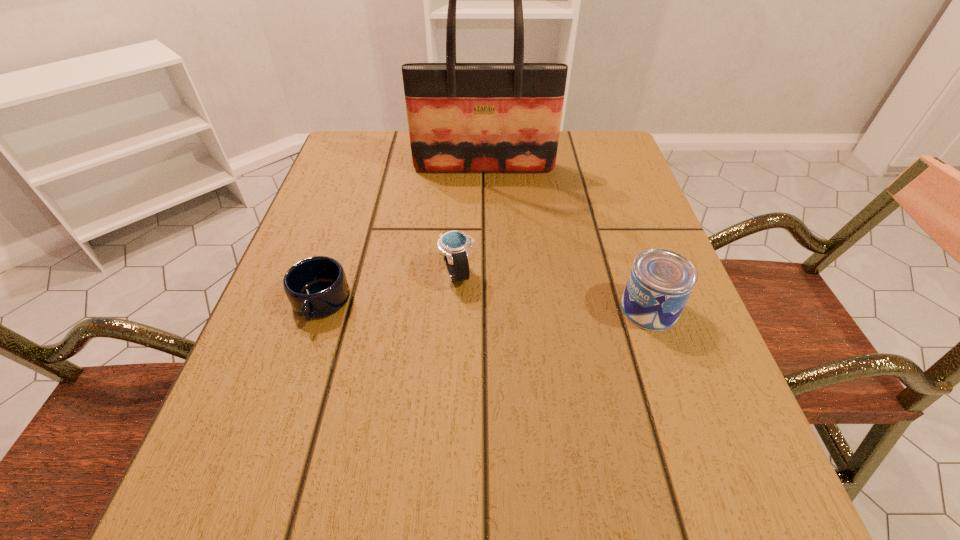
Point out which object is positioned as the nearest to the can. Please provide its 2D coordinates. Your answer should be formatted as a tuple, i.e. [(x, y)], where the tuple contains the x and y coordinates of a point satisfying the conditions above.

[(455, 245)]